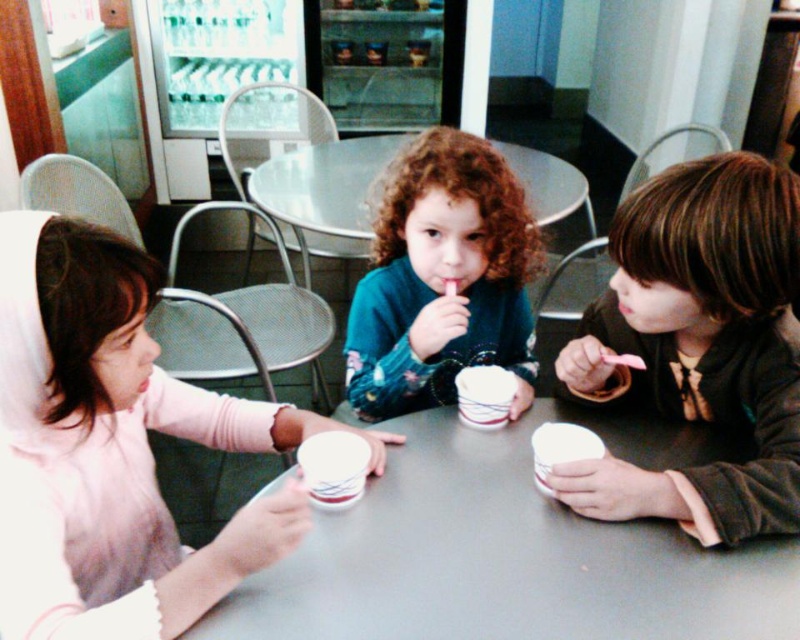
Between pink matte cupcake at center and teal floral sweater at center, which one has more height?

Standing taller between the two is pink matte cupcake at center.

Which is more to the right, pink matte cupcake at center or teal floral sweater at center?

teal floral sweater at center

Identify the location of pink matte cupcake at center. (114, 448).

Consider the image. Between white plastic table at center and brown matte jacket at right, which one is positioned higher?

Positioned higher is brown matte jacket at right.

Does white plastic table at center have a lesser height compared to brown matte jacket at right?

Yes, white plastic table at center is shorter than brown matte jacket at right.

This screenshot has width=800, height=640. In order to click on white plastic table at center in this screenshot , I will do `click(512, 552)`.

Identify the location of white plastic table at center. (512, 552).

Is white plastic table at center above teal floral sweater at center?

Incorrect, white plastic table at center is not positioned above teal floral sweater at center.

Can you confirm if white plastic table at center is taller than teal floral sweater at center?

No.

Image resolution: width=800 pixels, height=640 pixels. Describe the element at coordinates (512, 552) in the screenshot. I see `white plastic table at center` at that location.

Where is `white plastic table at center`? The width and height of the screenshot is (800, 640). white plastic table at center is located at coordinates (512, 552).